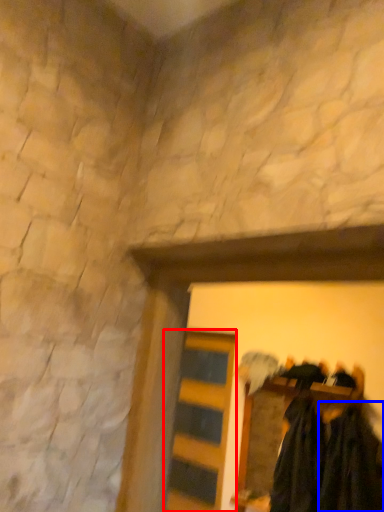
Question: Which point is closer to the camera, barn door (highlighted by a red box) or clothing (highlighted by a blue box)?

Choices:
 (A) barn door
 (B) clothing

Answer: (B)